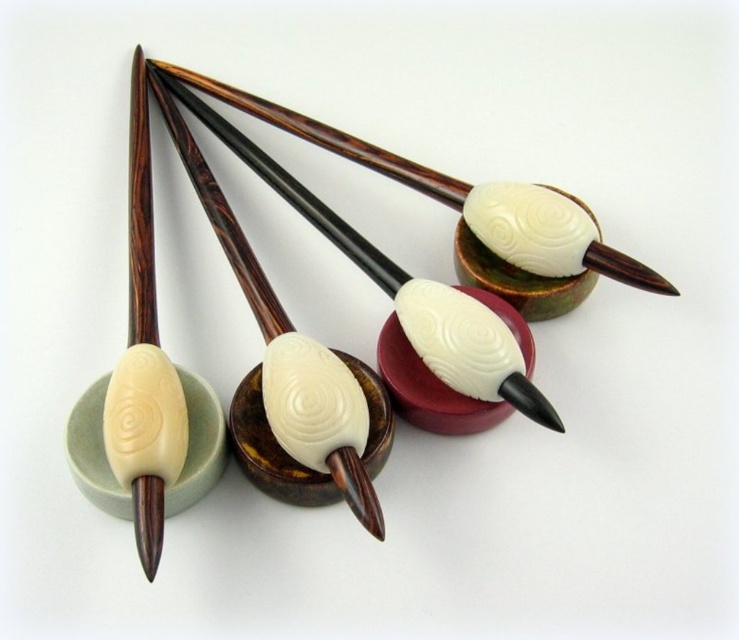
Between wooden chopsticks at upper center and matte brown bowl at center, which one has more height?

With more height is wooden chopsticks at upper center.

Does wooden chopsticks at upper center have a greater height compared to matte brown bowl at center?

Correct, wooden chopsticks at upper center is much taller as matte brown bowl at center.

Image resolution: width=739 pixels, height=640 pixels. I want to click on wooden chopsticks at upper center, so click(469, 200).

Where is `wooden chopsticks at upper center`? wooden chopsticks at upper center is located at coordinates (469, 200).

Which is more to the right, wooden chopsticks at upper center or green matte bowl at lower left?

Positioned to the right is wooden chopsticks at upper center.

Does wooden chopsticks at upper center have a larger size compared to green matte bowl at lower left?

Yes, wooden chopsticks at upper center is bigger than green matte bowl at lower left.

Is point (466, 209) positioned in front of point (188, 371)?

No, it is not.

Identify the location of wooden chopsticks at upper center. The width and height of the screenshot is (739, 640). (469, 200).

Does green matte bowl at lower left have a lesser width compared to polished dark wood bowl at center?

Indeed, green matte bowl at lower left has a lesser width compared to polished dark wood bowl at center.

Consider the image. Who is positioned more to the left, green matte bowl at lower left or polished dark wood bowl at center?

From the viewer's perspective, green matte bowl at lower left appears more on the left side.

Is point (115, 513) positioned before point (415, 372)?

That is True.

The image size is (739, 640). I want to click on green matte bowl at lower left, so click(197, 445).